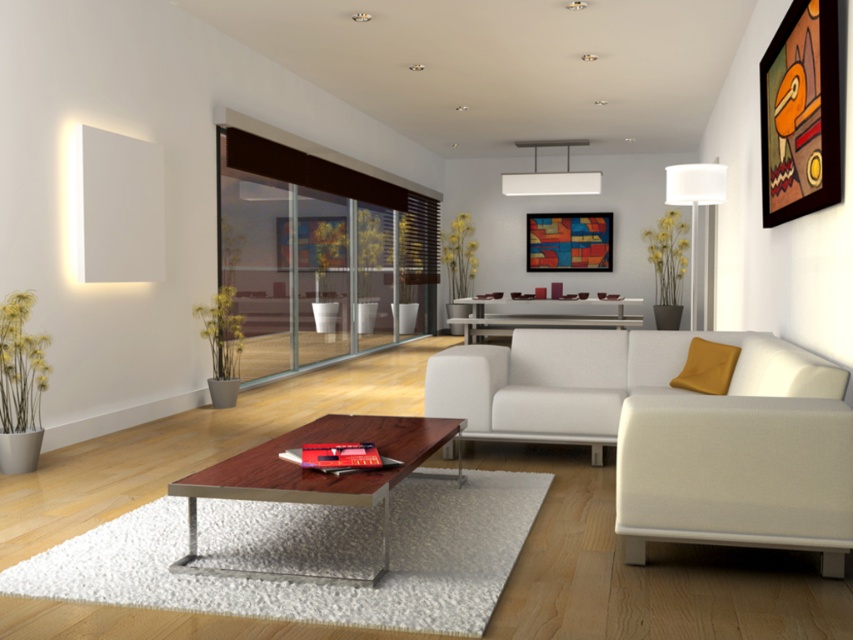
You are standing in the living room and want to place a decorative vase on the table that is to the right of the artwork. Which table should you choose between the wooden framed artwork at upper right and the metallic silver console table at center?

The metallic silver console table at center is to the right of the wooden framed artwork at upper right, so you should place the vase on the metallic silver console table at center.